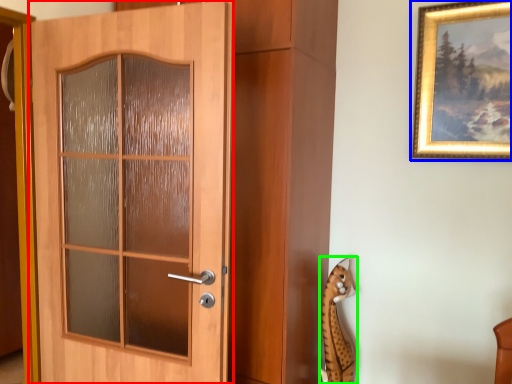
Question: Estimate the real-world distances between objects in this image. Which object is closer to door (highlighted by a red box), picture frame (highlighted by a blue box) or animal (highlighted by a green box)?

Choices:
 (A) picture frame
 (B) animal

Answer: (B)